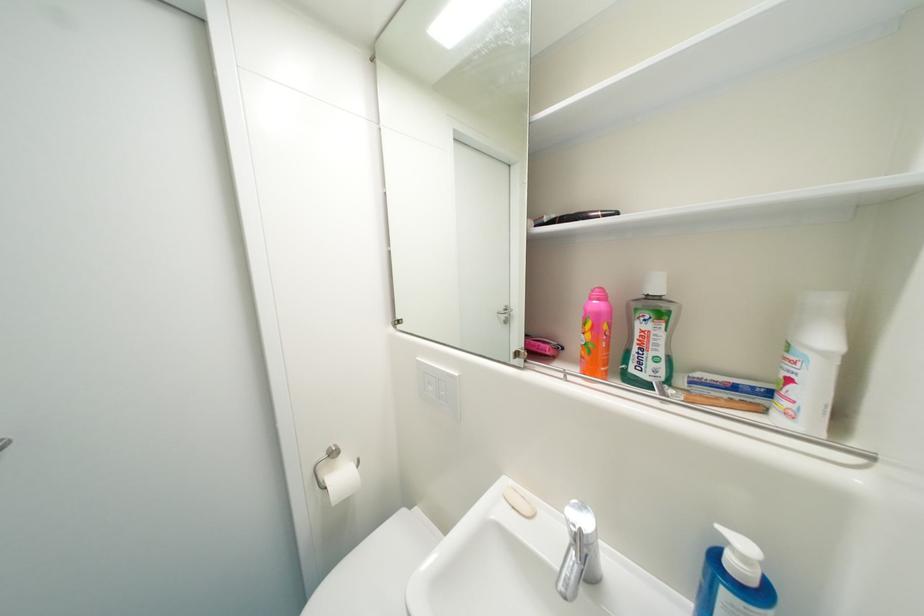
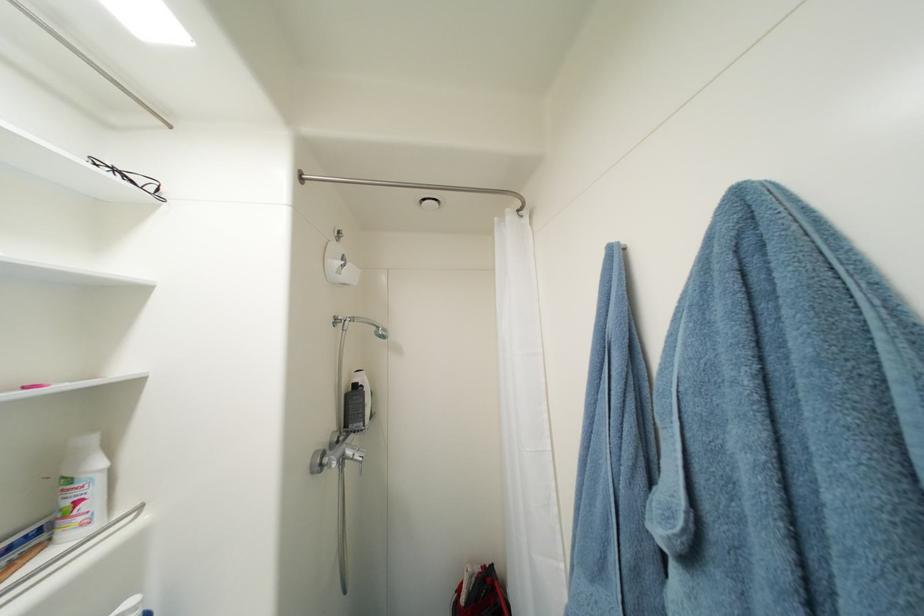
Question: I am providing you with two images of the same scene from different viewpoints. Which of the following objects are not visible in image2?

Choices:
 (A) black eyeglasses
 (B) white plastic bottle
 (C) red and black bag
 (D) none of these

Answer: (D)